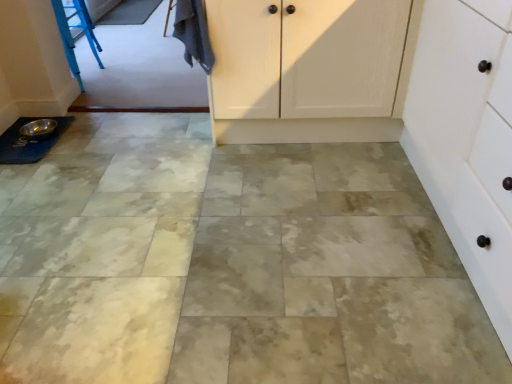
Question: Is dark gray fabric at upper left to the left or to the right of white matte cabinet at right in the image?

Choices:
 (A) left
 (B) right

Answer: (A)

Question: In the image, is dark gray fabric at upper left positioned in front of or behind white matte cabinet at right?

Choices:
 (A) front
 (B) behind

Answer: (B)

Question: Which is farther from the silver metallic bowl at lower left?

Choices:
 (A) dark gray fabric at upper left
 (B) white matte cabinet at right

Answer: (B)

Question: Estimate the real-world distances between objects in this image. Which object is farther from the white matte cabinet at right?

Choices:
 (A) silver metallic bowl at lower left
 (B) dark gray fabric at upper left

Answer: (A)